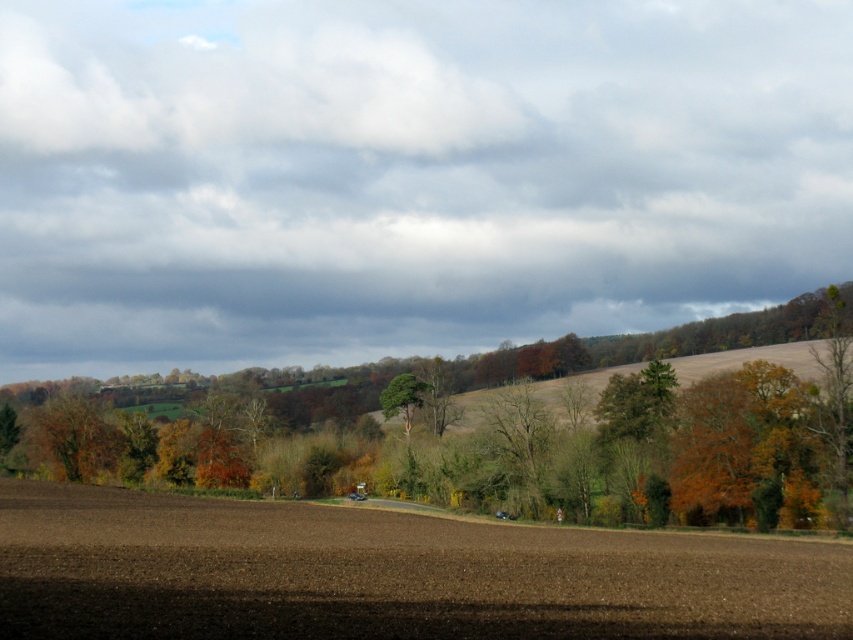
You are a landscape photographer planning to capture the scene with a wide angle lens. You want to ensure both the brown leafy tree at center and the green rough bark tree at center are in the frame. Which tree will appear wider in your photograph?

The brown leafy tree at center will appear wider in the photograph because its width surpasses that of the green rough bark tree at center according to the description.

You are standing in the rural landscape and want to take a photo of both the brown soil at center and the green rough bark tree at center. Which object should you focus on first to ensure both are in sharp focus?

The brown soil at center is closer to the viewer than the green rough bark tree at center. To ensure both are in sharp focus, you should focus on the green rough bark tree at center first, as focusing on the farther object allows for a greater depth of field that can include the closer object within the focus range.

Consider the image. You are a bird looking for a place to perch. You see the brown leafy tree at center and the green rough bark tree at center. Which tree would you choose if you prefer a larger tree to rest on?

The brown leafy tree at center is bigger than the green rough bark tree at center, so you should choose the brown leafy tree at center.